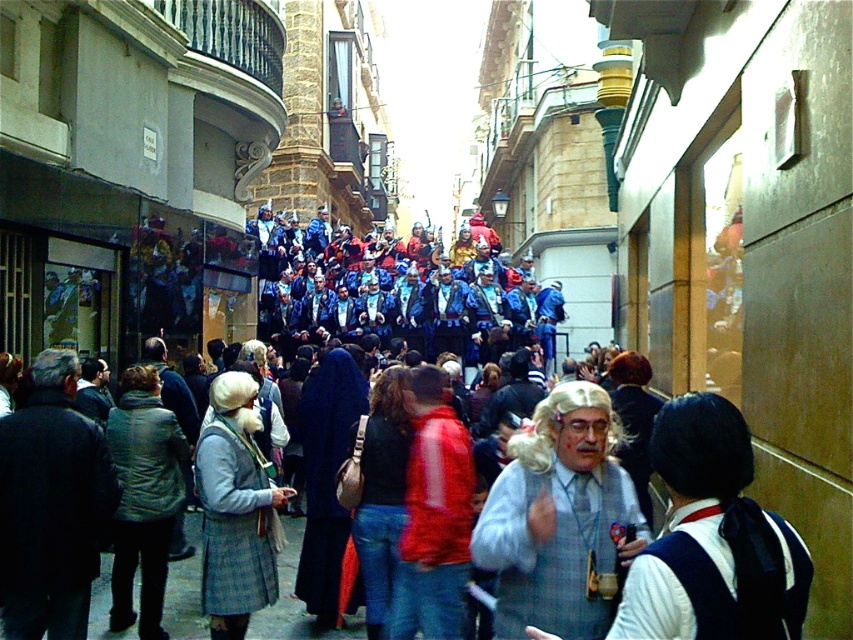
Question: Is blue fabric crowd at center closer to the viewer compared to white curly wig at center?

Choices:
 (A) yes
 (B) no

Answer: (A)

Question: Is blue fabric crowd at center further to camera compared to white curly wig at center?

Choices:
 (A) no
 (B) yes

Answer: (A)

Question: Which of the following is the farthest from the observer?

Choices:
 (A) blue fabric crowd at center
 (B) white curly wig at center

Answer: (B)

Question: Observing the image, what is the correct spatial positioning of blue fabric crowd at center in reference to white curly wig at center?

Choices:
 (A) below
 (B) above

Answer: (B)